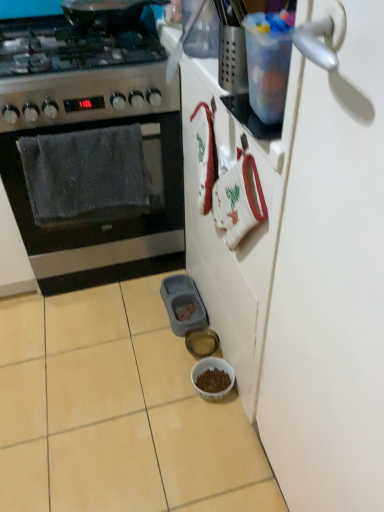
Question: Considering the relative sizes of translucent glass bowl at lower center, the first bowl from the back, and stainless steel oven at left in the image provided, is translucent glass bowl at lower center, the first bowl from the back, taller than stainless steel oven at left?

Choices:
 (A) no
 (B) yes

Answer: (A)

Question: Can you confirm if translucent glass bowl at lower center, the 2th bowl in the front-to-back sequence, is positioned to the left of stainless steel oven at left?

Choices:
 (A) no
 (B) yes

Answer: (A)

Question: Is translucent glass bowl at lower center, the first bowl from the back, touching stainless steel oven at left?

Choices:
 (A) no
 (B) yes

Answer: (A)

Question: Does translucent glass bowl at lower center, the 2th bowl in the front-to-back sequence, come in front of stainless steel oven at left?

Choices:
 (A) no
 (B) yes

Answer: (A)

Question: Is translucent glass bowl at lower center, the 2th bowl in the front-to-back sequence, positioned beyond the bounds of stainless steel oven at left?

Choices:
 (A) yes
 (B) no

Answer: (A)

Question: Looking at their shapes, would you say stainless steel gas stove at left is wider or thinner than stainless steel oven at left?

Choices:
 (A) thin
 (B) wide

Answer: (A)

Question: From the image's perspective, is stainless steel gas stove at left positioned above or below stainless steel oven at left?

Choices:
 (A) above
 (B) below

Answer: (A)

Question: Considering the relative positions of stainless steel gas stove at left and stainless steel oven at left in the image provided, is stainless steel gas stove at left to the left or to the right of stainless steel oven at left?

Choices:
 (A) right
 (B) left

Answer: (B)

Question: Is stainless steel gas stove at left taller or shorter than stainless steel oven at left?

Choices:
 (A) tall
 (B) short

Answer: (B)

Question: Is point pos(337,489) positioned closer to the camera than point pos(193,375)?

Choices:
 (A) farther
 (B) closer

Answer: (B)

Question: Is white matte door at right in front of or behind brown matte bowl at lower center, the 1th bowl when ordered from front to back, in the image?

Choices:
 (A) behind
 (B) front

Answer: (B)

Question: From a real-world perspective, is white matte door at right physically located above or below brown matte bowl at lower center, which is counted as the 2th bowl, starting from the back?

Choices:
 (A) below
 (B) above

Answer: (B)

Question: Would you say white matte door at right is to the left or to the right of brown matte bowl at lower center, which is counted as the 2th bowl, starting from the back, in the picture?

Choices:
 (A) right
 (B) left

Answer: (A)

Question: Is stainless steel gas stove at left situated inside translucent glass bowl at lower center, the 2th bowl in the front-to-back sequence, or outside?

Choices:
 (A) inside
 (B) outside

Answer: (B)

Question: Is stainless steel gas stove at left in front of or behind translucent glass bowl at lower center, the first bowl from the back, in the image?

Choices:
 (A) behind
 (B) front

Answer: (B)